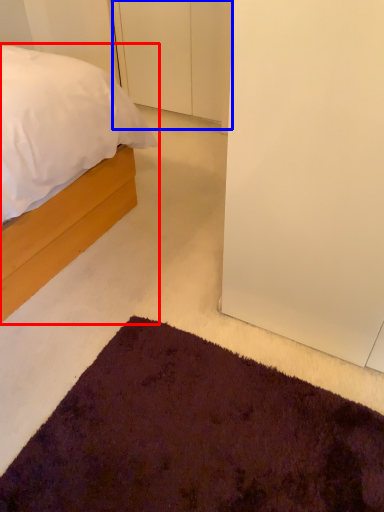
Question: Which object appears farthest to the camera in this image, bed (highlighted by a red box) or door (highlighted by a blue box)?

Choices:
 (A) bed
 (B) door

Answer: (B)